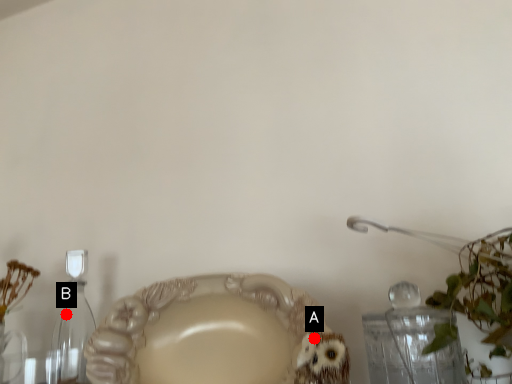
Question: Two points are circled on the image, labeled by A and B beside each circle. Which point appears closest to the camera in this image?

Choices:
 (A) A is closer
 (B) B is closer

Answer: (A)